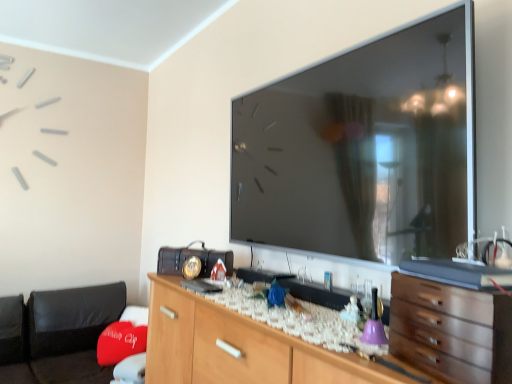
Question: Considering the positions of metallic vintage radio at center and wooden chest of drawers at lower right in the image, is metallic vintage radio at center taller or shorter than wooden chest of drawers at lower right?

Choices:
 (A) short
 (B) tall

Answer: (A)

Question: In the image, is metallic vintage radio at center on the left side or the right side of wooden chest of drawers at lower right?

Choices:
 (A) right
 (B) left

Answer: (B)

Question: Based on their relative distances, which object is farther from the wooden cabinet at center?

Choices:
 (A) wooden chest of drawers at lower right
 (B) metallic vintage radio at center
 (C) red fabric bean bag at lower left

Answer: (C)

Question: Estimate the real-world distances between objects in this image. Which object is closer to the red fabric bean bag at lower left?

Choices:
 (A) metallic vintage radio at center
 (B) wooden chest of drawers at lower right
 (C) wooden cabinet at center

Answer: (C)